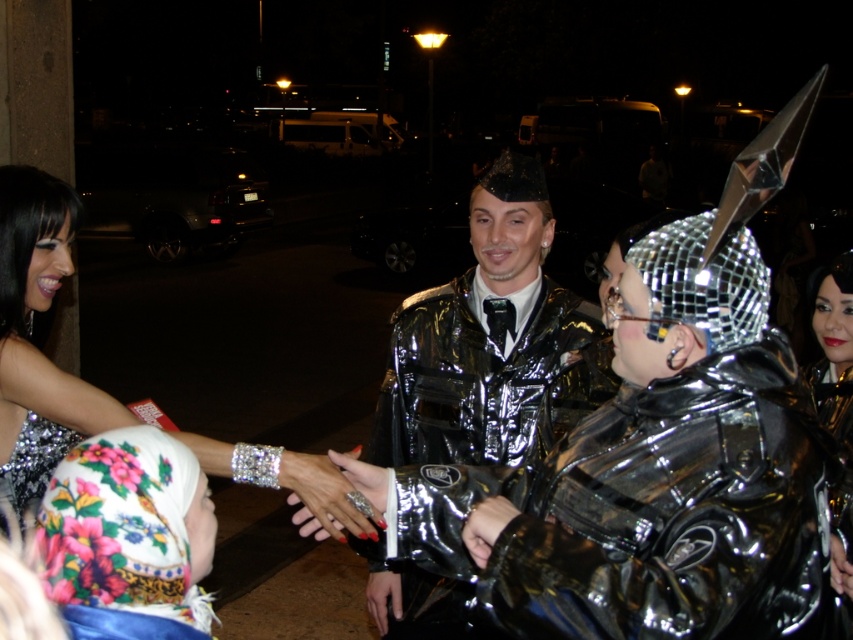
At what (x,y) coordinates should I click in order to perform the action: click on shiny metallic jacket at center. Please return your answer as a coordinate pair (x, y). Looking at the image, I should click on (492, 342).

Is shiny metallic jacket at center smaller than silver sequined dress at left?

No.

Who is more forward, [468,288] or [27,268]?

Point [27,268] is more forward.

Image resolution: width=853 pixels, height=640 pixels. I want to click on shiny metallic jacket at center, so coord(492,342).

Locate an element on the screen. shiny metallic jacket at center is located at coordinates (492, 342).

Consider the image. Does shiny metallic jacket at center have a larger size compared to shiny metallic helmet at center?

No.

Does point (532, 161) come farther from viewer compared to point (828, 333)?

That is False.

Where is `shiny metallic jacket at center`? shiny metallic jacket at center is located at coordinates (492, 342).

Who is positioned more to the left, silver sequined dress at left or shiny metallic helmet at center?

silver sequined dress at left is more to the left.

Is point (310, 497) closer to viewer compared to point (834, 384)?

Yes, it is in front of point (834, 384).

Is point (73, 202) more distant than point (849, 356)?

No, (73, 202) is closer to viewer.

The image size is (853, 640). Identify the location of silver sequined dress at left. (32, 342).